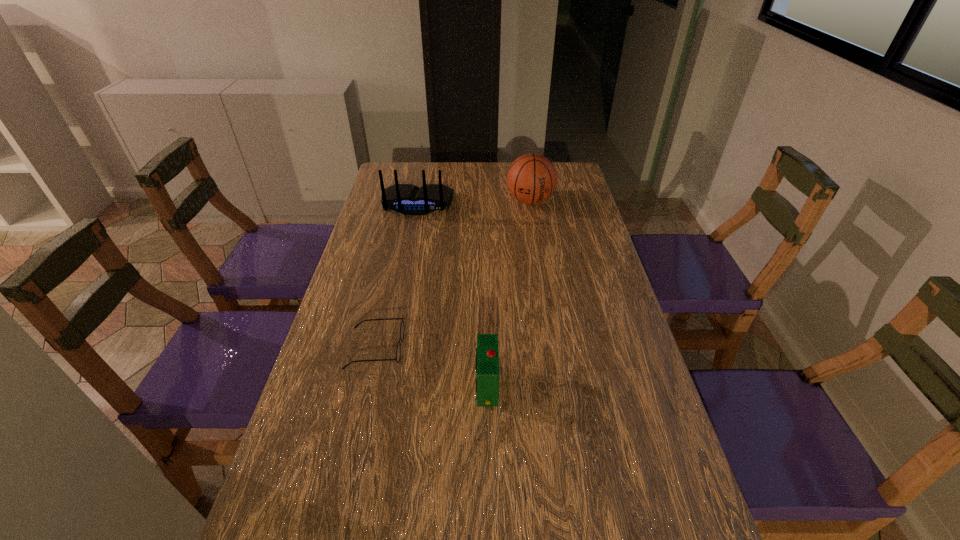
The width and height of the screenshot is (960, 540). Identify the location of vacant point located between the shortest object and the rightmost object. (453, 274).

This screenshot has height=540, width=960. In order to click on free space between the shortest object and the rightmost object in this screenshot , I will do `click(453, 274)`.

Identify the location of vacant point located between the basketball and the spectacles. (453, 274).

Find the location of a particular element. free space between the third tallest object and the spectacles is located at coordinates (431, 367).

Identify the location of empty space that is in between the router and the second object from right to left. (452, 295).

The width and height of the screenshot is (960, 540). Identify the location of vacant space in between the router and the basketball. (473, 202).

Find the location of a particular element. The width and height of the screenshot is (960, 540). vacant space in between the basketball and the alarm clock is located at coordinates (509, 293).

Image resolution: width=960 pixels, height=540 pixels. I want to click on vacant area that lies between the alarm clock and the spectacles, so click(x=431, y=367).

Find the location of `vacant region between the basketball and the third object from left to right`. vacant region between the basketball and the third object from left to right is located at coordinates (509, 293).

In order to click on free point between the router and the third tallest object in this screenshot , I will do `click(452, 295)`.